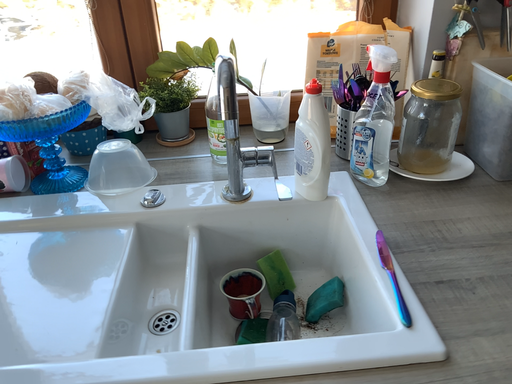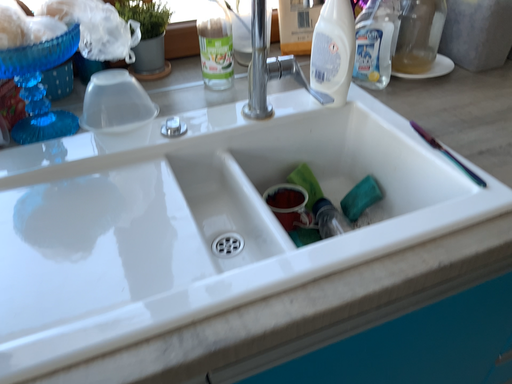
Question: Which way did the camera rotate in the video?

Choices:
 (A) rotated left
 (B) rotated right

Answer: (B)